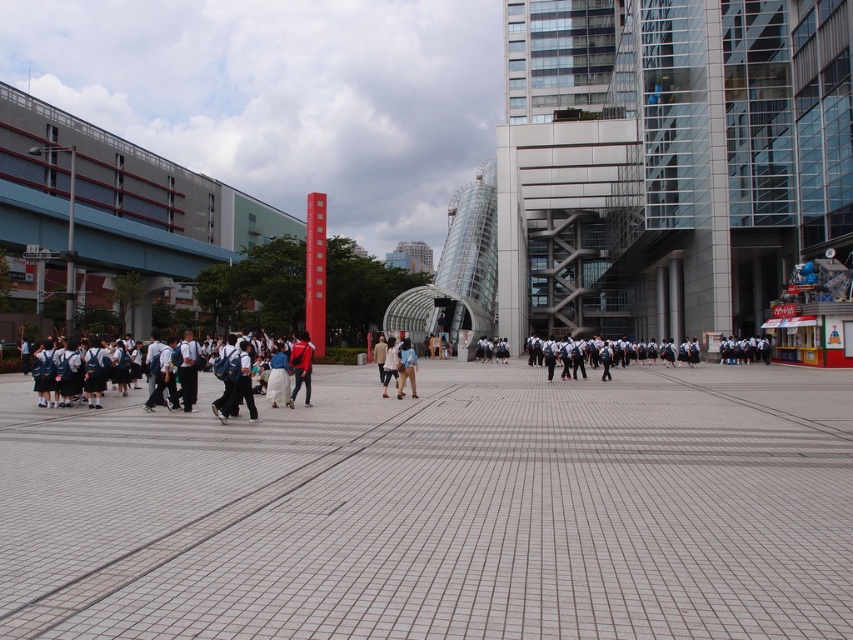
Is point (587, 387) behind point (405, 346)?

Yes, it is behind point (405, 346).

The height and width of the screenshot is (640, 853). What do you see at coordinates (440, 509) in the screenshot?
I see `gray tile pavement at center` at bounding box center [440, 509].

Find the location of `gray tile pavement at center`. gray tile pavement at center is located at coordinates (440, 509).

Which is more to the right, red fabric jacket at center or light brown leather jacket at center?

light brown leather jacket at center is more to the right.

Is point (309, 385) behind point (387, 364)?

No, (309, 385) is in front of (387, 364).

Describe the element at coordinates (300, 365) in the screenshot. I see `red fabric jacket at center` at that location.

Locate an element on the screen. Image resolution: width=853 pixels, height=640 pixels. red fabric jacket at center is located at coordinates (300, 365).

In the scene shown: Does gray tile pavement at center have a greater height compared to light brown leather jacket at center?

No.

Who is more forward, (412, 413) or (384, 388)?

Positioned in front is point (412, 413).

Locate an element on the screen. This screenshot has width=853, height=640. gray tile pavement at center is located at coordinates (440, 509).

At what (x,y) coordinates should I click in order to perform the action: click on gray tile pavement at center. Please return your answer as a coordinate pair (x, y). This screenshot has width=853, height=640. Looking at the image, I should click on (440, 509).